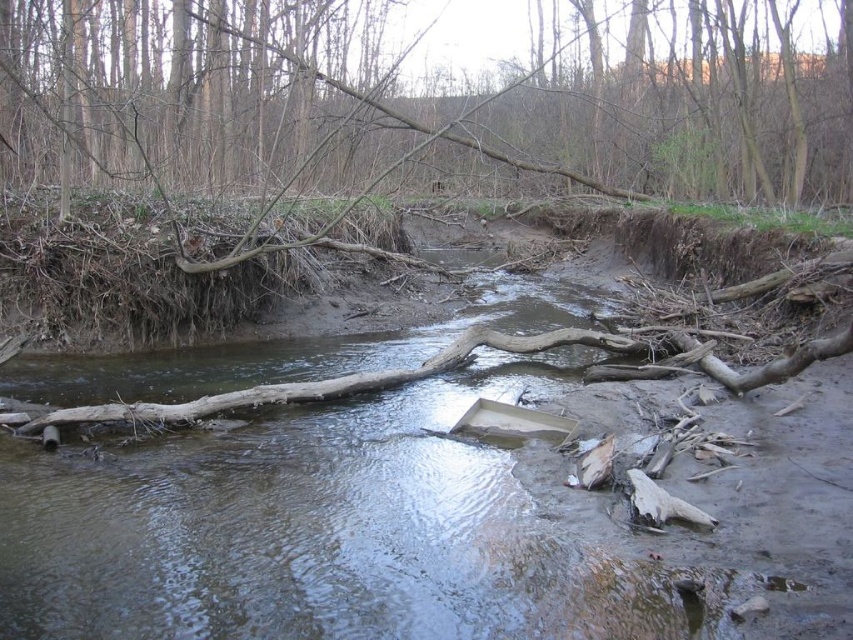
You are trying to cross the brown wood log at center to reach the other side of the brown muddy river at center. Is the log fully submerged in the river?

The brown muddy river at center is positioned under brown wood log at center, which means the log is resting on top of the river, so it is not fully submerged and can be used to cross.

You are standing at the edge of the stream and want to cross it. There are two points marked on the stream bed where you could potentially step. The first point is at coordinate (482,392) and the second is at (567,42). Based on the scene description, which point is closer to you and safer to step on?

Point (482,392) is closer to the viewer than point (567,42), so it is safer to step on point (482,392) because it is nearer and offers a more stable footing.